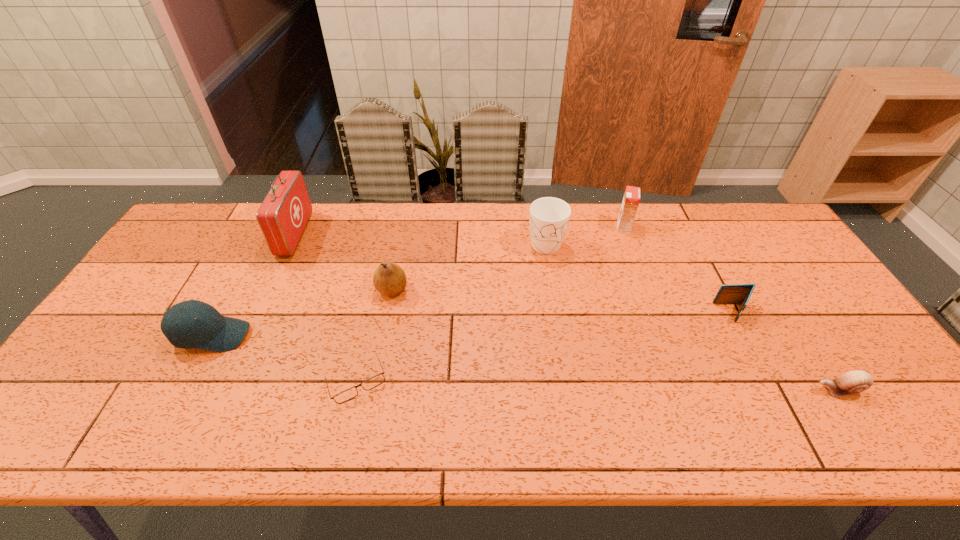
Find the location of a particular element. The width and height of the screenshot is (960, 540). free space located 0.190m on the front of the orange juice is located at coordinates (641, 274).

Find the location of a particular element. vacant space located 0.360m on the front of the pear is located at coordinates (367, 422).

Locate an element on the screen. The width and height of the screenshot is (960, 540). vacant region located on the front-facing side of the baseball cap is located at coordinates (329, 335).

The width and height of the screenshot is (960, 540). I want to click on vacant space located 0.350m on the exterior surface of the seventh object from left to right, so click(x=589, y=313).

The width and height of the screenshot is (960, 540). I want to click on vacant space located on the exterior surface of the seventh object from left to right, so click(x=681, y=313).

Identify the location of free location located 0.090m on the exterior surface of the seventh object from left to right. (684, 313).

At what (x,y) coordinates should I click in order to perform the action: click on free point located 0.310m on the front-facing side of the rightmost object. Please return your answer as a coordinate pair (x, y). Looking at the image, I should click on (683, 390).

Where is `free space located 0.320m on the front-facing side of the rightmost object`? The height and width of the screenshot is (540, 960). free space located 0.320m on the front-facing side of the rightmost object is located at coordinates (678, 390).

This screenshot has height=540, width=960. I want to click on vacant position located on the front-facing side of the rightmost object, so click(780, 390).

Locate an element on the screen. The image size is (960, 540). vacant space located 0.100m with the lenses facing outward on the spectacles is located at coordinates (342, 448).